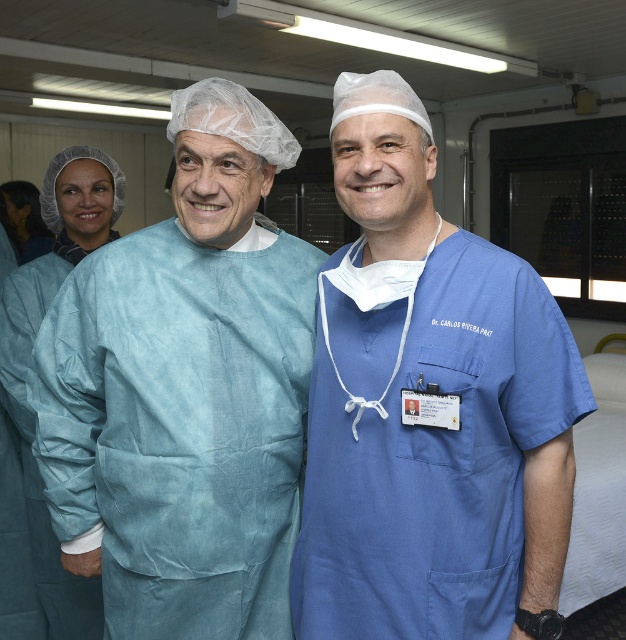
You are a medical student observing a surgical team. You notice two sets of scrubs in the scene. Which set of scrubs, the blue smooth scrubs at center or the blue scrubs at left, is closer to you?

The blue smooth scrubs at center is shorter than blue scrubs at left, so the blue smooth scrubs at center is closer to you because shorter objects appear closer in the visual field.

In the scene described, where exactly is the blue scrubs at center located in terms of coordinates?

The blue scrubs at center is located at point coordinates of [429,406].

You are a medical intern in the hospital and need to locate the blue scrubs at center. Based on the coordinates provided, where should you look to find them?

The blue scrubs at center are located at the coordinates point (429,406).